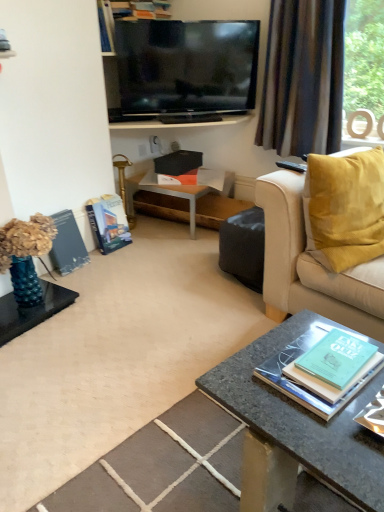
Where is `empty space that is ontop of granite coffee table at lower center`? empty space that is ontop of granite coffee table at lower center is located at coordinates (309, 397).